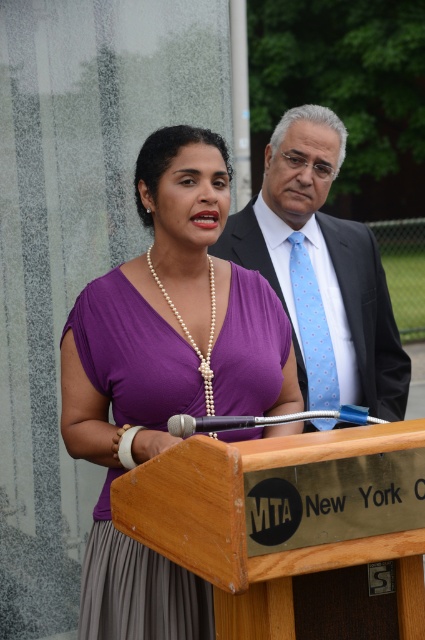
Can you confirm if purple satin dress at center is thinner than pearl necklace at center?

In fact, purple satin dress at center might be wider than pearl necklace at center.

Does purple satin dress at center have a greater width compared to pearl necklace at center?

Indeed, purple satin dress at center has a greater width compared to pearl necklace at center.

Find the location of a particular element. This screenshot has height=640, width=425. purple satin dress at center is located at coordinates (164, 372).

Can you confirm if dark gray suit at center is wider than pearl necklace at center?

Yes, dark gray suit at center is wider than pearl necklace at center.

Who is more distant from viewer, (260, 253) or (212, 268)?

The point (260, 253) is behind.

Measure the distance between point (x=325, y=163) and camera.

Point (x=325, y=163) is 3.40 meters away from camera.

You are a GUI agent. You are given a task and a screenshot of the screen. Output one action in this format:
    pyautogui.click(x=<x>, y=<y>)
    Task: Click on the dark gray suit at center
    This screenshot has width=425, height=640.
    Given the screenshot: What is the action you would take?
    pyautogui.click(x=320, y=269)

Who is lower down, blue dotted tie at center or pearl necklace at center?

pearl necklace at center

Does point (306, 349) come in front of point (214, 292)?

No.

Image resolution: width=425 pixels, height=640 pixels. In order to click on blue dotted tie at center in this screenshot , I will do `click(312, 328)`.